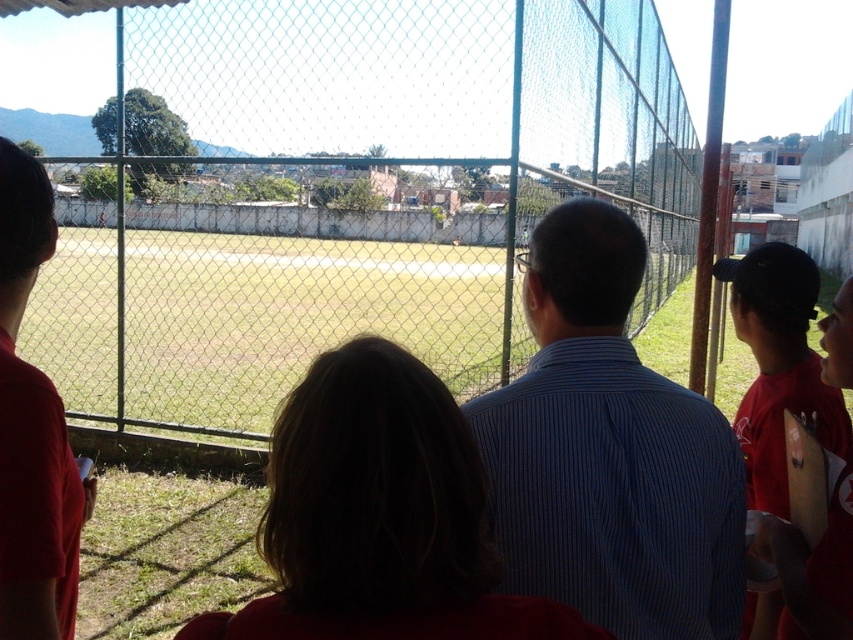
Question: Does metal mesh fence at center appear over red cotton shirt at right?

Choices:
 (A) yes
 (B) no

Answer: (A)

Question: Estimate the real-world distances between objects in this image. Which object is closer to the metal mesh fence at center?

Choices:
 (A) blue striped shirt at center
 (B) red shirt at left

Answer: (A)

Question: Which is farther from the metal mesh fence at center?

Choices:
 (A) red shirt at left
 (B) red cotton shirt at right
 (C) blue striped shirt at center

Answer: (B)

Question: Is red shirt at left to the left of red cotton shirt at right from the viewer's perspective?

Choices:
 (A) no
 (B) yes

Answer: (B)

Question: Which object appears closest to the camera in this image?

Choices:
 (A) red shirt at left
 (B) blue striped shirt at center
 (C) metal mesh fence at center

Answer: (B)

Question: Can you confirm if blue striped shirt at center is positioned above red shirt at left?

Choices:
 (A) yes
 (B) no

Answer: (B)